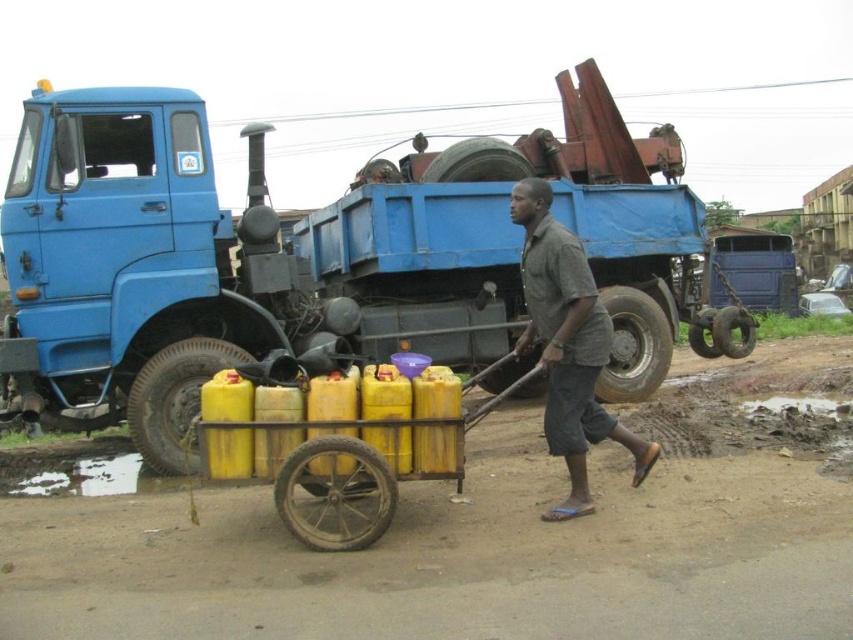
Does blue matte truck at center have a lesser width compared to yellow matte plastic cart at center?

Yes.

Who is more forward, (177,236) or (363,472)?

Point (363,472)

Which is in front, point (647, 224) or point (328, 540)?

Point (328, 540) is more forward.

This screenshot has height=640, width=853. In order to click on blue matte truck at center in this screenshot , I will do 316,257.

Measure the distance between blue matte truck at center and camera.

blue matte truck at center is 32.57 feet from camera.

Is blue matte truck at center above gray cotton shirt at center?

Correct, blue matte truck at center is located above gray cotton shirt at center.

Does point (180, 193) lie in front of point (514, 195)?

No, it is not.

This screenshot has height=640, width=853. Identify the location of blue matte truck at center. (316, 257).

Can you confirm if yellow matte plastic cart at center is smaller than gray cotton shirt at center?

Incorrect, yellow matte plastic cart at center is not smaller in size than gray cotton shirt at center.

Does yellow matte plastic cart at center appear on the right side of gray cotton shirt at center?

Incorrect, yellow matte plastic cart at center is not on the right side of gray cotton shirt at center.

Is point (364, 522) positioned after point (548, 300)?

No, (364, 522) is in front of (548, 300).

At what (x,y) coordinates should I click in order to perform the action: click on yellow matte plastic cart at center. Please return your answer as a coordinate pair (x, y). Looking at the image, I should click on (341, 444).